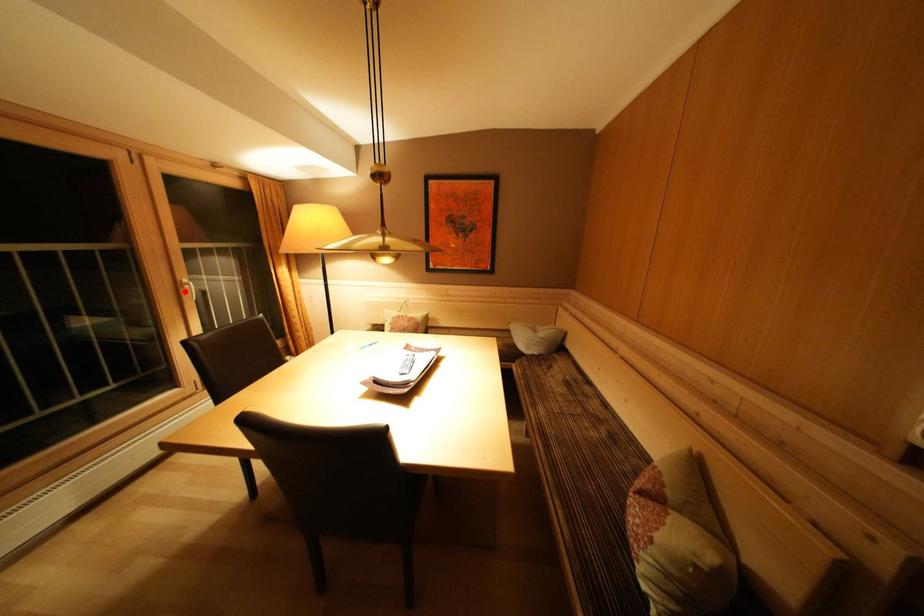
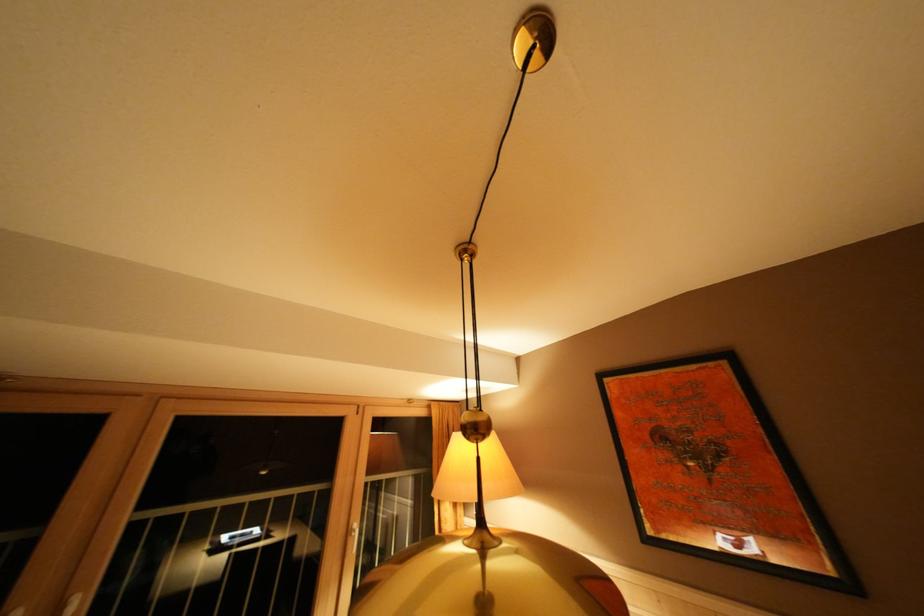
Question: I am providing you with two images of the same scene from different viewpoints. A red point is shown in image1. For the corresponding object point in image2, is it positioned nearer or farther from the camera?

Choices:
 (A) Nearer
 (B) Farther

Answer: (B)